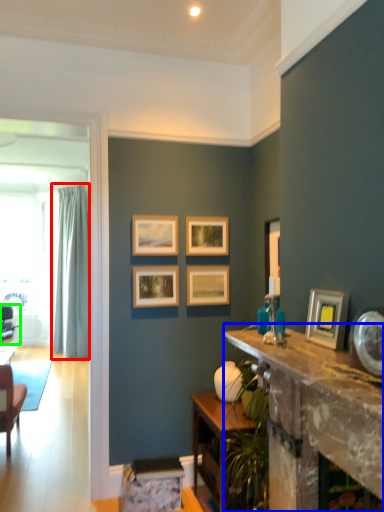
Question: Which is nearer to the curtain (highlighted by a red box)? table (highlighted by a blue box) or chair (highlighted by a green box).

Choices:
 (A) table
 (B) chair

Answer: (B)